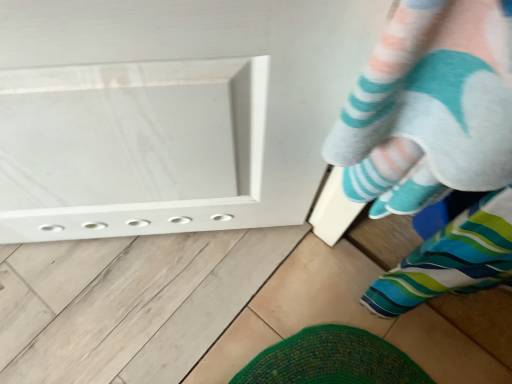
Question: From a real-world perspective, is striped socks at lower right physically below striped fabric sock at lower right?

Choices:
 (A) no
 (B) yes

Answer: (A)

Question: Is striped socks at lower right outside of striped fabric sock at lower right?

Choices:
 (A) no
 (B) yes

Answer: (B)

Question: Does striped socks at lower right come behind striped fabric sock at lower right?

Choices:
 (A) yes
 (B) no

Answer: (B)

Question: Does striped socks at lower right have a greater height compared to striped fabric sock at lower right?

Choices:
 (A) no
 (B) yes

Answer: (B)

Question: Is striped socks at lower right positioned far away from striped fabric sock at lower right?

Choices:
 (A) yes
 (B) no

Answer: (B)

Question: From a real-world perspective, is striped socks at lower right located higher than striped fabric sock at lower right?

Choices:
 (A) yes
 (B) no

Answer: (A)

Question: From the image's perspective, is striped fabric sock at lower right on striped socks at lower right?

Choices:
 (A) yes
 (B) no

Answer: (B)

Question: Is the position of striped fabric sock at lower right less distant than that of striped socks at lower right?

Choices:
 (A) yes
 (B) no

Answer: (B)

Question: Does striped fabric sock at lower right turn towards striped socks at lower right?

Choices:
 (A) no
 (B) yes

Answer: (A)

Question: Is striped fabric sock at lower right placed right next to striped socks at lower right?

Choices:
 (A) no
 (B) yes

Answer: (A)

Question: Considering the relative positions of striped fabric sock at lower right and striped socks at lower right in the image provided, is striped fabric sock at lower right to the left of striped socks at lower right from the viewer's perspective?

Choices:
 (A) yes
 (B) no

Answer: (B)

Question: From a real-world perspective, is striped fabric sock at lower right over striped socks at lower right?

Choices:
 (A) no
 (B) yes

Answer: (A)

Question: Is striped fabric sock at lower right in front of or behind striped socks at lower right in the image?

Choices:
 (A) front
 (B) behind

Answer: (B)